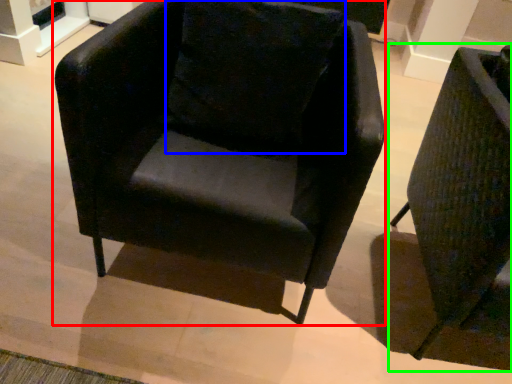
Question: Considering the real-world distances, which object is farthest from chair (highlighted by a red box)? pillow (highlighted by a blue box) or chair (highlighted by a green box)?

Choices:
 (A) pillow
 (B) chair

Answer: (B)